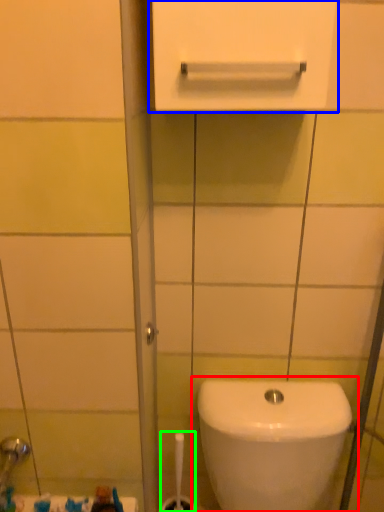
Question: Estimate the real-world distances between objects in this image. Which object is farther from toilet (highlighted by a red box), medicine cabinet (highlighted by a blue box) or brush (highlighted by a green box)?

Choices:
 (A) medicine cabinet
 (B) brush

Answer: (A)